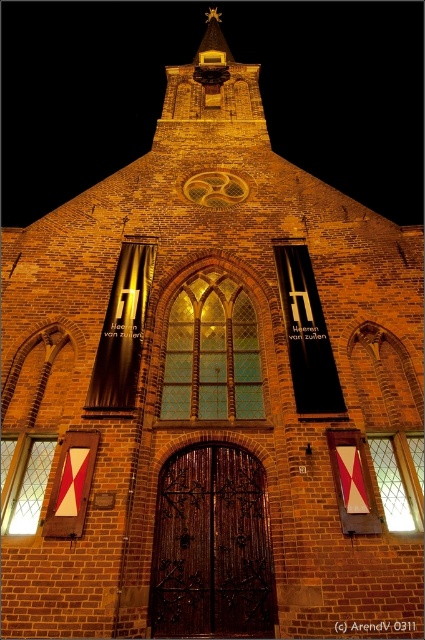
Question: Does dark brown wood at center appear on the right side of translucent glass window at center?

Choices:
 (A) no
 (B) yes

Answer: (B)

Question: Is dark brown wood at center positioned behind transparent glass window at lower right?

Choices:
 (A) yes
 (B) no

Answer: (B)

Question: Which point is closer to the camera?

Choices:
 (A) dark brown wood at center
 (B) translucent glass window at center
 (C) transparent glass window at lower left

Answer: (A)

Question: Is the position of translucent glass window at center more distant than that of transparent glass window at lower left?

Choices:
 (A) yes
 (B) no

Answer: (A)

Question: Considering the real-world distances, which object is farthest from the transparent glass window at lower right?

Choices:
 (A) translucent glass window at center
 (B) dark brown wood at center

Answer: (A)

Question: Which object is positioned closest to the translucent glass window at center?

Choices:
 (A) transparent glass window at lower left
 (B) dark brown wood at center

Answer: (B)